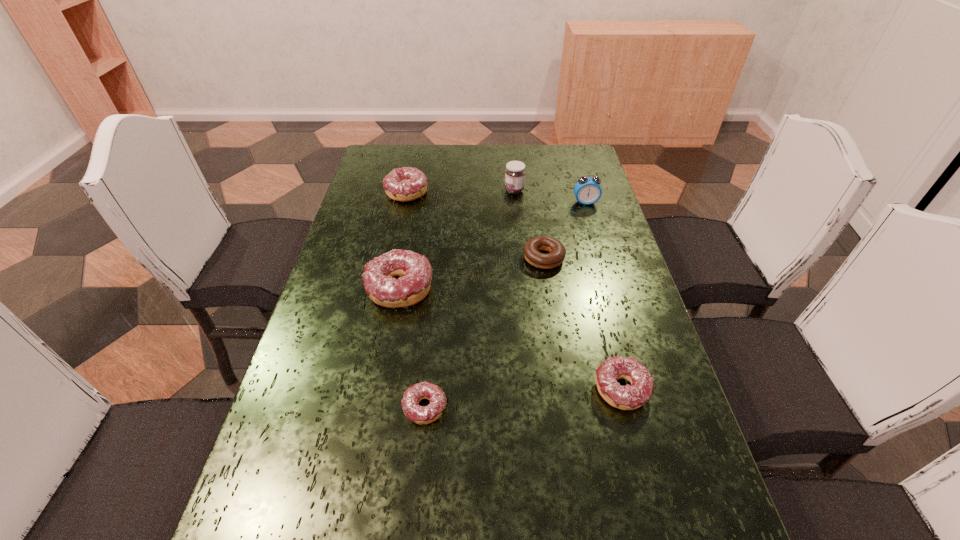
The height and width of the screenshot is (540, 960). In order to click on jam in this screenshot , I will do `click(515, 171)`.

The width and height of the screenshot is (960, 540). Identify the location of alarm clock. (587, 190).

Where is `the tallest doughnut`? This screenshot has height=540, width=960. the tallest doughnut is located at coordinates (415, 271).

At what (x,y) coordinates should I click in order to perform the action: click on the second farthest pink doughnut. Please return your answer as a coordinate pair (x, y). This screenshot has width=960, height=540. Looking at the image, I should click on (415, 271).

This screenshot has height=540, width=960. What are the coordinates of `the fourth shortest doughnut` in the screenshot? It's located at (404, 184).

You are a GUI agent. You are given a task and a screenshot of the screen. Output one action in this format:
    pyautogui.click(x=<x>, y=<y>)
    Task: Click on the fourth tallest object
    The image size is (960, 540).
    Given the screenshot: What is the action you would take?
    pyautogui.click(x=404, y=184)

Find the location of a particular element. This screenshot has height=540, width=960. the rightmost pink doughnut is located at coordinates (629, 397).

Locate an element on the screen. This screenshot has height=540, width=960. the third shortest object is located at coordinates (629, 397).

Find the location of `brown doughnut`. brown doughnut is located at coordinates (531, 249).

This screenshot has height=540, width=960. Find the location of `the smallest pink doughnut`. the smallest pink doughnut is located at coordinates (414, 394).